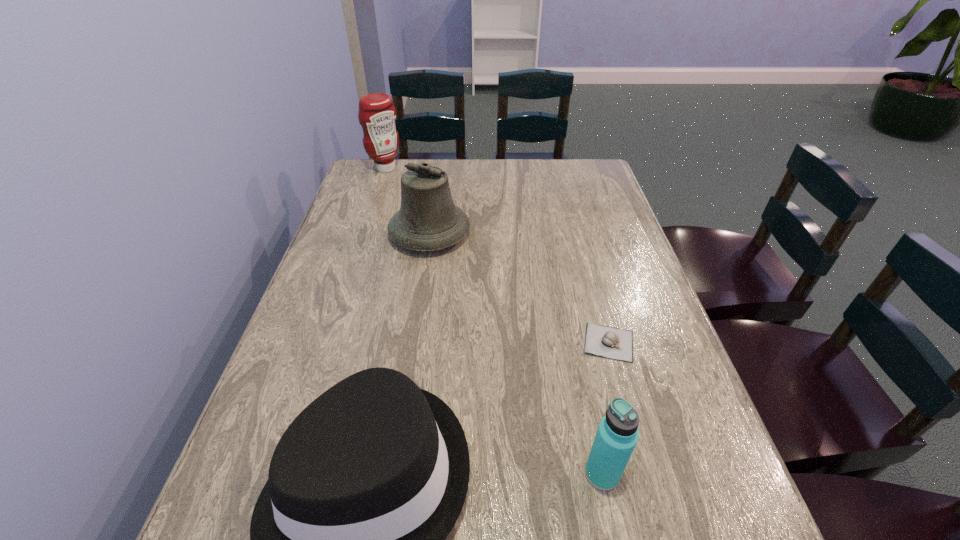
The image size is (960, 540). I want to click on vacant area that lies between the fourth nearest object and the thermos bottle, so click(x=516, y=354).

Where is `free space between the bell and the third nearest object`? The height and width of the screenshot is (540, 960). free space between the bell and the third nearest object is located at coordinates (519, 288).

The height and width of the screenshot is (540, 960). Find the location of `free space between the fourth nearest object and the garlic`. free space between the fourth nearest object and the garlic is located at coordinates (519, 288).

This screenshot has width=960, height=540. Identify the location of vacant region between the thermos bottle and the condiment. (493, 321).

The image size is (960, 540). I want to click on free space between the second farthest object and the third farthest object, so click(519, 288).

Identify the location of object that is the second closest to the fedora. (603, 341).

Where is `object that stands as the second closest to the thermos bottle`? The width and height of the screenshot is (960, 540). object that stands as the second closest to the thermos bottle is located at coordinates (603, 341).

The width and height of the screenshot is (960, 540). In order to click on free point that satisfies the following two spatial constraints: 1. on the front side of the thermos bottle; 2. on the left side of the second farthest object in this screenshot , I will do `click(396, 474)`.

I want to click on free spot that satisfies the following two spatial constraints: 1. on the back side of the thermos bottle; 2. on the left side of the shortest object, so click(575, 342).